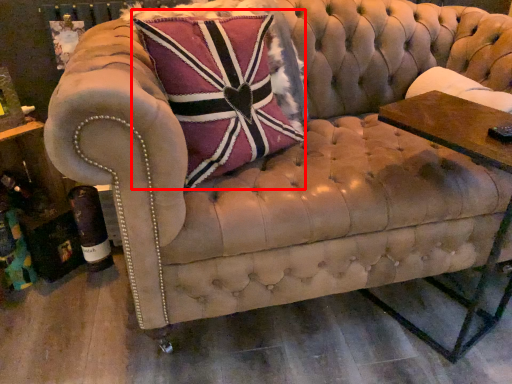
Question: From the image's perspective, where is throw pillow (annotated by the red box) located relative to side table?

Choices:
 (A) above
 (B) below

Answer: (A)